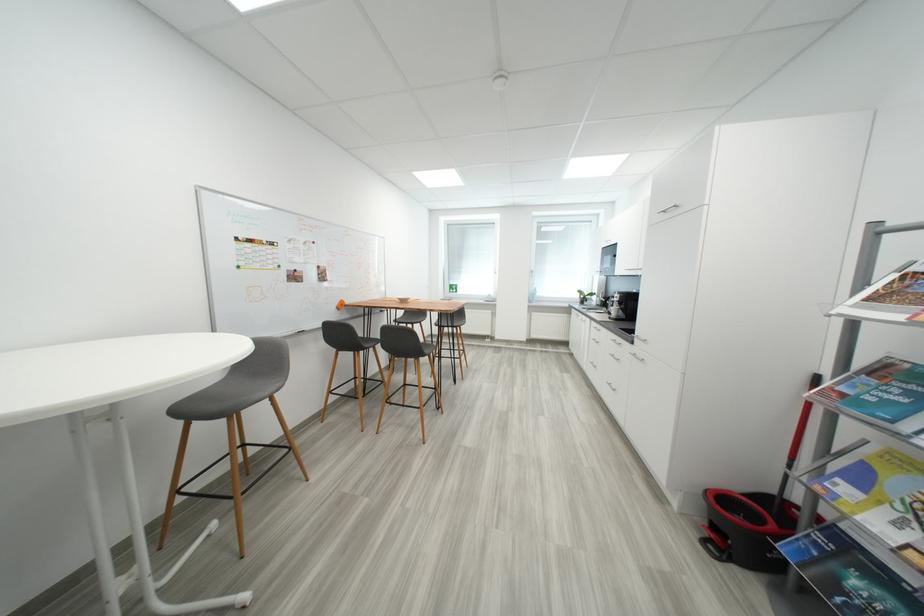
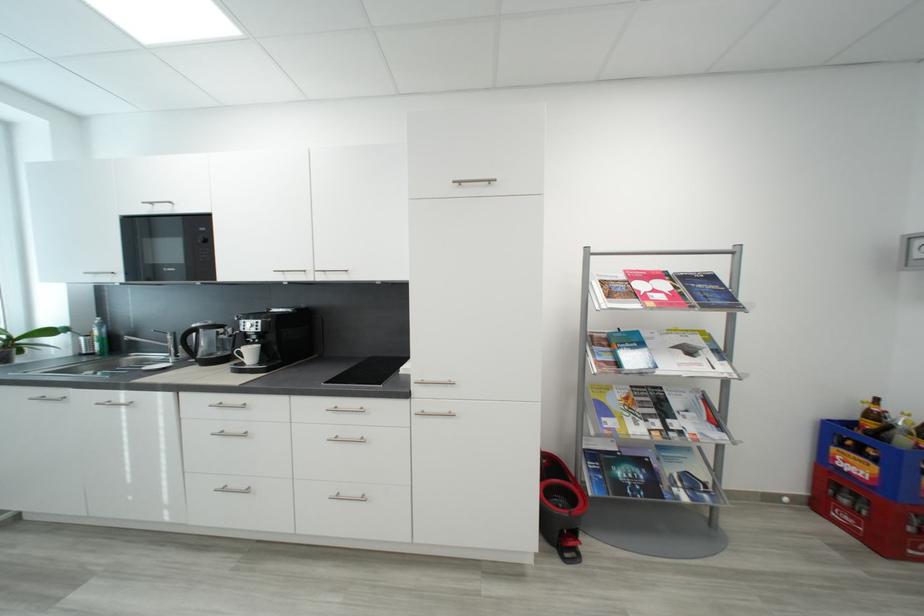
Find the pixel in the second image that matches (718,548) in the first image.

(574, 557)